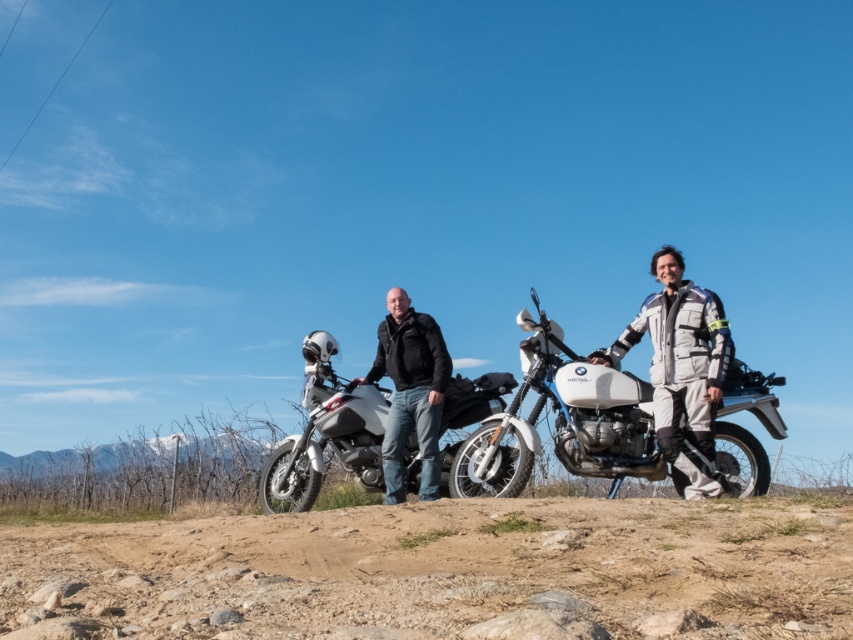
Can you confirm if white matte motorcycle at center is taller than white matte adventure bike at center?

Indeed, white matte motorcycle at center has a greater height compared to white matte adventure bike at center.

Who is more forward, (x=550, y=378) or (x=490, y=390)?

Point (x=550, y=378)

Measure the distance between point (x=618, y=406) and camera.

Point (x=618, y=406) is 7.92 meters from camera.

Find the location of a particular element. Image resolution: width=853 pixels, height=640 pixels. white matte motorcycle at center is located at coordinates (564, 422).

Who is more forward, (339, 403) or (691, 458)?

Point (691, 458)

Which is more to the right, white matte adventure bike at center or gray textured jacket at center?

From the viewer's perspective, gray textured jacket at center appears more on the right side.

The width and height of the screenshot is (853, 640). Find the location of `white matte adventure bike at center`. white matte adventure bike at center is located at coordinates click(x=326, y=435).

Is gray textured jacket at center bigger than black matte jacket at center?

Actually, gray textured jacket at center might be smaller than black matte jacket at center.

Which of these two, gray textured jacket at center or black matte jacket at center, stands taller?

Standing taller between the two is gray textured jacket at center.

Between point (697, 300) and point (421, 420), which one is positioned in front?

Point (697, 300) is in front.

Locate an element on the screen. The width and height of the screenshot is (853, 640). gray textured jacket at center is located at coordinates (682, 371).